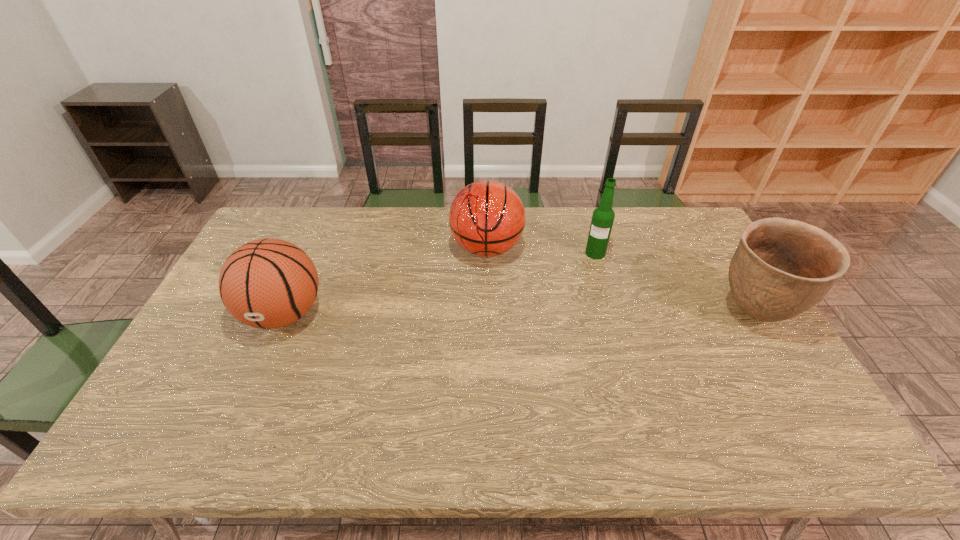
Locate an element on the screen. free location located on the label of the beer bottle is located at coordinates click(x=579, y=335).

Locate an element on the screen. The height and width of the screenshot is (540, 960). free region located on the side with spill of the farther basketball is located at coordinates click(468, 310).

Locate an element on the screen. vacant space located on the side with spill of the farther basketball is located at coordinates (469, 306).

Locate an element on the screen. free space located on the side with spill of the farther basketball is located at coordinates (459, 342).

In order to click on beer bottle located in the far edge section of the desktop in this screenshot , I will do `click(603, 216)`.

Image resolution: width=960 pixels, height=540 pixels. In order to click on basketball that is positioned at the far edge in this screenshot , I will do `click(487, 218)`.

Find the location of `object present at the left edge`. object present at the left edge is located at coordinates (267, 283).

In order to click on object situated at the right edge in this screenshot , I will do `click(781, 268)`.

Locate an element on the screen. Image resolution: width=960 pixels, height=540 pixels. vacant region at the far edge is located at coordinates (383, 245).

This screenshot has height=540, width=960. In the image, there is a desktop. Find the location of `vacant space at the near edge`. vacant space at the near edge is located at coordinates (397, 381).